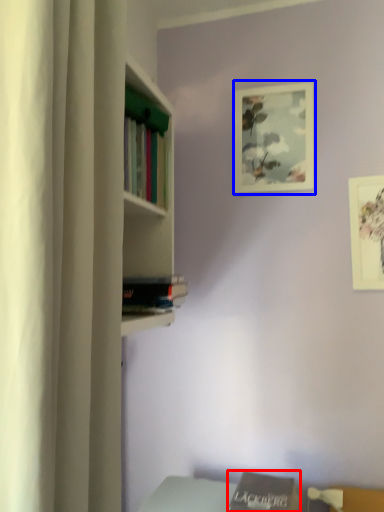
Question: Which object is closer to the camera taking this photo, book (highlighted by a red box) or picture frame (highlighted by a blue box)?

Choices:
 (A) book
 (B) picture frame

Answer: (A)